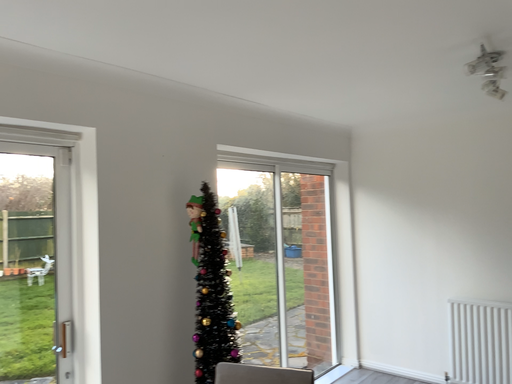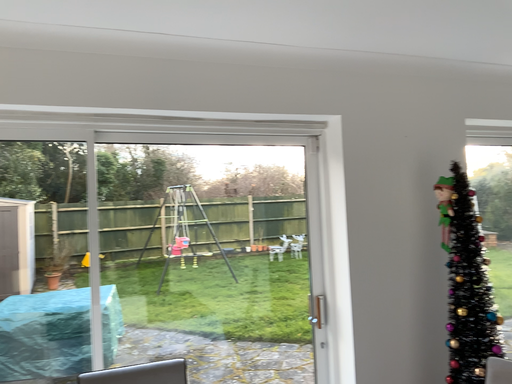
Question: How did the camera likely rotate when shooting the video?

Choices:
 (A) rotated left
 (B) rotated right

Answer: (A)